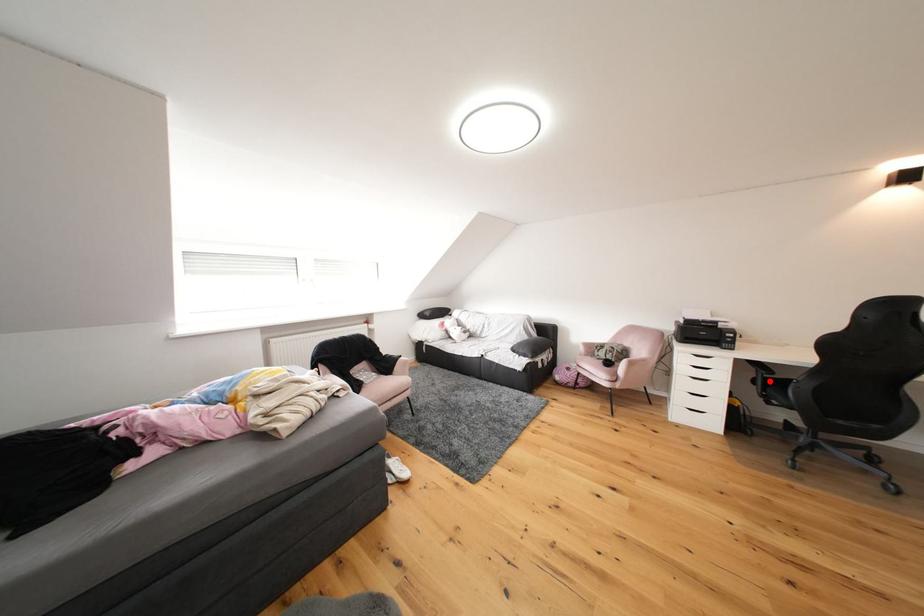
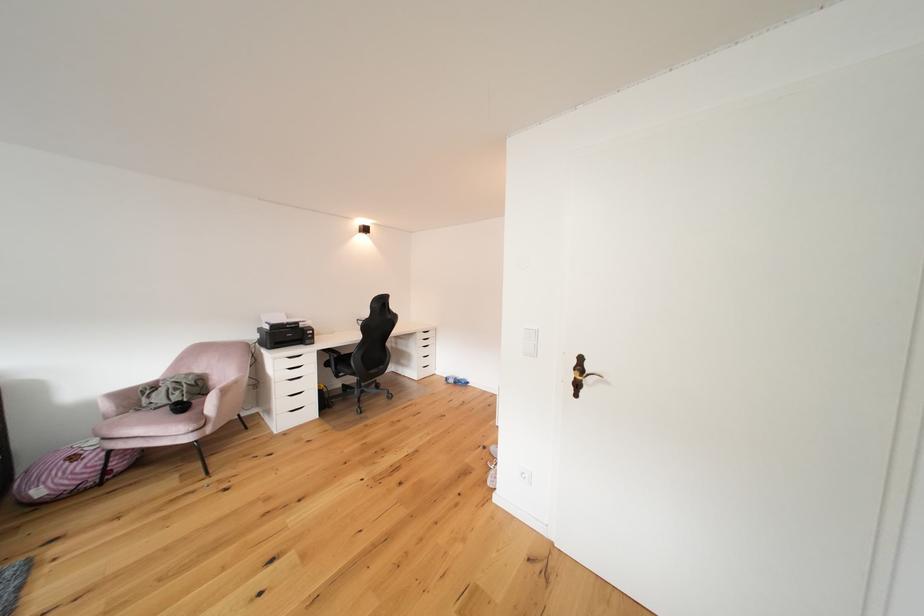
Locate, in the second image, the point that corresponds to the highlighted location in the first image.

(343, 363)